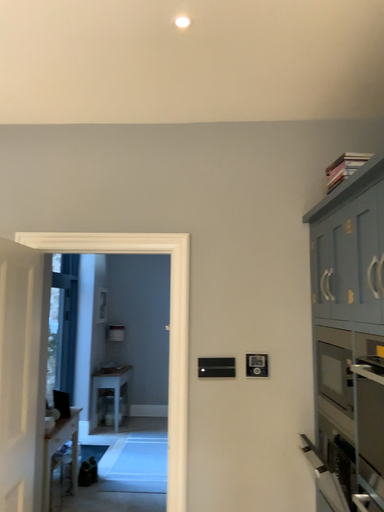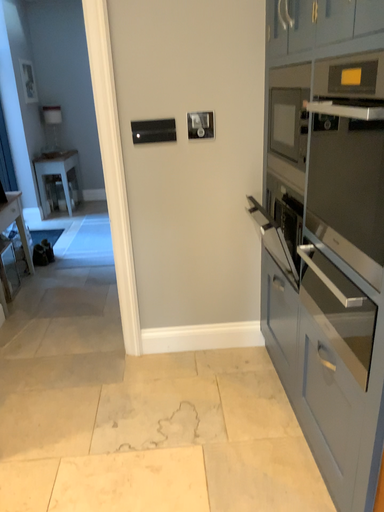
Question: Which way did the camera rotate in the video?

Choices:
 (A) rotated upward
 (B) rotated downward

Answer: (B)